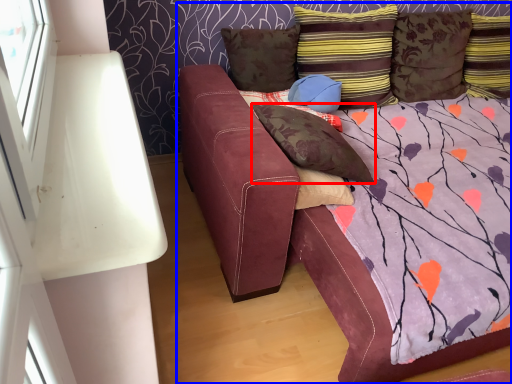
Question: Which object appears farthest to the camera in this image, pillow (highlighted by a red box) or studio couch (highlighted by a blue box)?

Choices:
 (A) pillow
 (B) studio couch

Answer: (A)